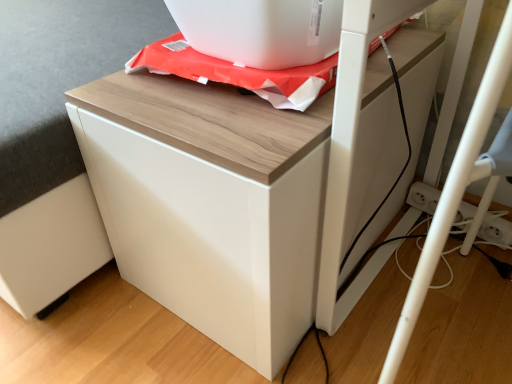
Question: Does white glossy cabinet at center come in front of white glossy appliance at upper center?

Choices:
 (A) yes
 (B) no

Answer: (A)

Question: From the image's perspective, is white glossy cabinet at center above white glossy appliance at upper center?

Choices:
 (A) yes
 (B) no

Answer: (B)

Question: Can you confirm if white glossy cabinet at center is thinner than white glossy appliance at upper center?

Choices:
 (A) yes
 (B) no

Answer: (B)

Question: From a real-world perspective, is white glossy cabinet at center over white glossy appliance at upper center?

Choices:
 (A) no
 (B) yes

Answer: (A)

Question: Does white glossy cabinet at center have a greater width compared to white glossy appliance at upper center?

Choices:
 (A) yes
 (B) no

Answer: (A)

Question: Is white glossy cabinet at center to the left of white glossy appliance at upper center from the viewer's perspective?

Choices:
 (A) no
 (B) yes

Answer: (B)

Question: Can you confirm if white glossy appliance at upper center is wider than white glossy cabinet at center?

Choices:
 (A) yes
 (B) no

Answer: (B)

Question: Is white glossy cabinet at center a part of white glossy appliance at upper center?

Choices:
 (A) yes
 (B) no

Answer: (B)

Question: Is white glossy appliance at upper center completely or partially outside of white glossy cabinet at center?

Choices:
 (A) no
 (B) yes

Answer: (B)

Question: From a real-world perspective, is white glossy appliance at upper center physically above white glossy cabinet at center?

Choices:
 (A) no
 (B) yes

Answer: (B)

Question: Is white glossy appliance at upper center bigger than white glossy cabinet at center?

Choices:
 (A) yes
 (B) no

Answer: (B)

Question: Is white glossy appliance at upper center positioned with its back to white glossy cabinet at center?

Choices:
 (A) no
 (B) yes

Answer: (A)

Question: From a real-world perspective, relative to white glossy appliance at upper center, is white glossy cabinet at center vertically above or below?

Choices:
 (A) below
 (B) above

Answer: (A)